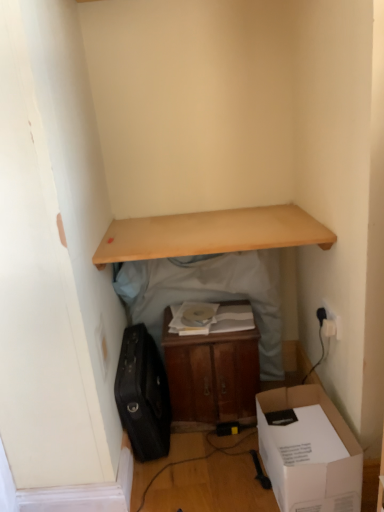
I want to click on empty space that is ontop of light wood shelf at upper center (from a real-world perspective), so click(213, 224).